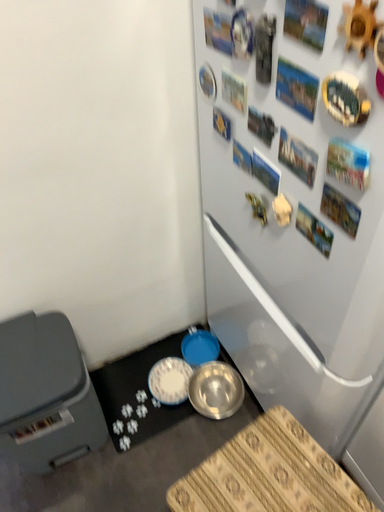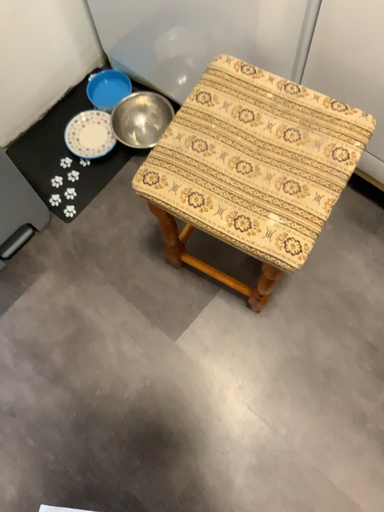
Question: How did the camera likely rotate when shooting the video?

Choices:
 (A) rotated downward
 (B) rotated upward

Answer: (A)